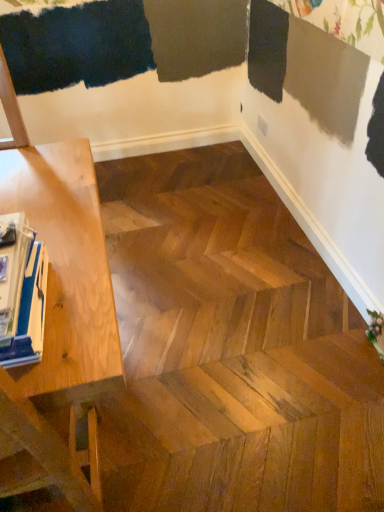
Question: Relative to blue glossy magazine at left, is light wood table at left in front or behind?

Choices:
 (A) front
 (B) behind

Answer: (A)

Question: Considering the positions of light wood table at left and blue glossy magazine at left in the image, is light wood table at left bigger or smaller than blue glossy magazine at left?

Choices:
 (A) small
 (B) big

Answer: (B)

Question: Considering the positions of light wood table at left and blue glossy magazine at left in the image, is light wood table at left taller or shorter than blue glossy magazine at left?

Choices:
 (A) short
 (B) tall

Answer: (B)

Question: Considering the positions of blue glossy magazine at left and light wood table at left in the image, is blue glossy magazine at left bigger or smaller than light wood table at left?

Choices:
 (A) small
 (B) big

Answer: (A)

Question: From a real-world perspective, relative to light wood table at left, is blue glossy magazine at left vertically above or below?

Choices:
 (A) above
 (B) below

Answer: (A)

Question: Is blue glossy magazine at left situated inside light wood table at left or outside?

Choices:
 (A) outside
 (B) inside

Answer: (B)

Question: Looking at their shapes, would you say blue glossy magazine at left is wider or thinner than light wood table at left?

Choices:
 (A) wide
 (B) thin

Answer: (B)